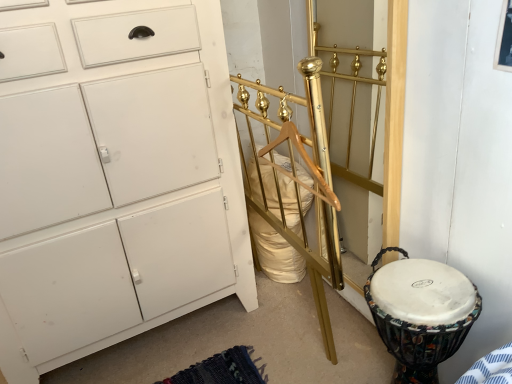
Question: Does gold polished metal bed frame at center have a smaller size compared to white fabric-covered drum at lower right?

Choices:
 (A) yes
 (B) no

Answer: (B)

Question: Is gold polished metal bed frame at center positioned before white fabric-covered drum at lower right?

Choices:
 (A) no
 (B) yes

Answer: (B)

Question: From a real-world perspective, is gold polished metal bed frame at center physically below white fabric-covered drum at lower right?

Choices:
 (A) no
 (B) yes

Answer: (A)

Question: Is gold polished metal bed frame at center not inside white fabric-covered drum at lower right?

Choices:
 (A) yes
 (B) no

Answer: (A)

Question: From the image's perspective, is gold polished metal bed frame at center above white fabric-covered drum at lower right?

Choices:
 (A) no
 (B) yes

Answer: (B)

Question: Considering the positions of point (417, 259) and point (317, 167), is point (417, 259) closer or farther from the camera than point (317, 167)?

Choices:
 (A) farther
 (B) closer

Answer: (A)

Question: From a real-world perspective, is white fabric-covered drum at lower right positioned above or below gold polished metal bed frame at center?

Choices:
 (A) above
 (B) below

Answer: (B)

Question: In the image, is white fabric-covered drum at lower right positioned in front of or behind gold polished metal bed frame at center?

Choices:
 (A) front
 (B) behind

Answer: (B)

Question: From the image's perspective, is white fabric-covered drum at lower right positioned above or below gold polished metal bed frame at center?

Choices:
 (A) above
 (B) below

Answer: (B)

Question: In terms of height, does gold polished metal bed frame at center look taller or shorter compared to white fabric-covered drum at lower right?

Choices:
 (A) short
 (B) tall

Answer: (B)

Question: From the image's perspective, is gold polished metal bed frame at center located above or below white fabric-covered drum at lower right?

Choices:
 (A) below
 (B) above

Answer: (B)

Question: Considering their positions, is gold polished metal bed frame at center located in front of or behind white fabric-covered drum at lower right?

Choices:
 (A) front
 (B) behind

Answer: (A)

Question: Which is correct: gold polished metal bed frame at center is inside white fabric-covered drum at lower right, or outside of it?

Choices:
 (A) outside
 (B) inside

Answer: (A)

Question: Is gold polished metal bed frame at center to the left or to the right of white matte cabinet at left in the image?

Choices:
 (A) right
 (B) left

Answer: (A)

Question: Is gold polished metal bed frame at center spatially inside white matte cabinet at left, or outside of it?

Choices:
 (A) outside
 (B) inside

Answer: (A)